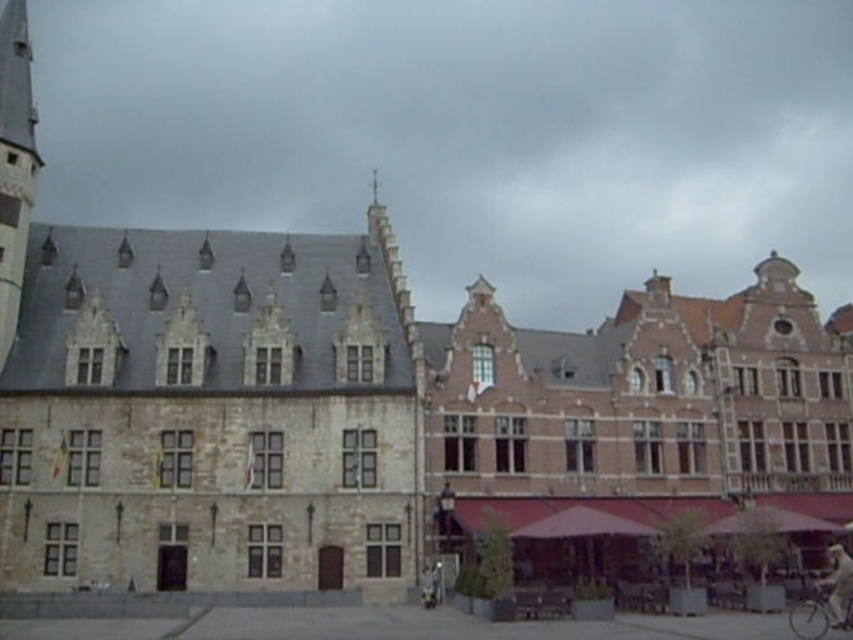
Question: Can you confirm if silver metallic bicycle at lower right is bigger than white cotton shirt at lower right?

Choices:
 (A) no
 (B) yes

Answer: (A)

Question: Which point is farther to the camera?

Choices:
 (A) silver metallic bicycle at lower right
 (B) white cotton shirt at lower right

Answer: (B)

Question: Which point appears closest to the camera in this image?

Choices:
 (A) (840, 557)
 (B) (827, 621)

Answer: (B)

Question: Is silver metallic bicycle at lower right positioned before white cotton shirt at lower right?

Choices:
 (A) no
 (B) yes

Answer: (B)

Question: Is silver metallic bicycle at lower right to the right of white cotton shirt at lower right from the viewer's perspective?

Choices:
 (A) no
 (B) yes

Answer: (A)

Question: Which object appears farthest from the camera in this image?

Choices:
 (A) white cotton shirt at lower right
 (B) silver metallic bicycle at lower right

Answer: (A)